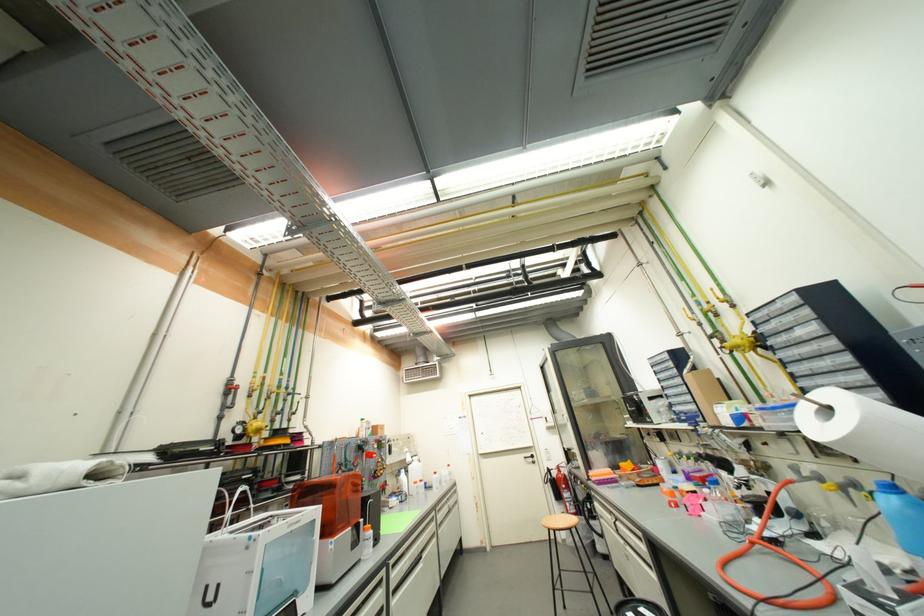
At what (x,y) coordinates should I click in order to perform the action: click on white paper towel. Please return your answer as a coordinate pair (x, y). The image size is (924, 616). Looking at the image, I should click on (864, 430).